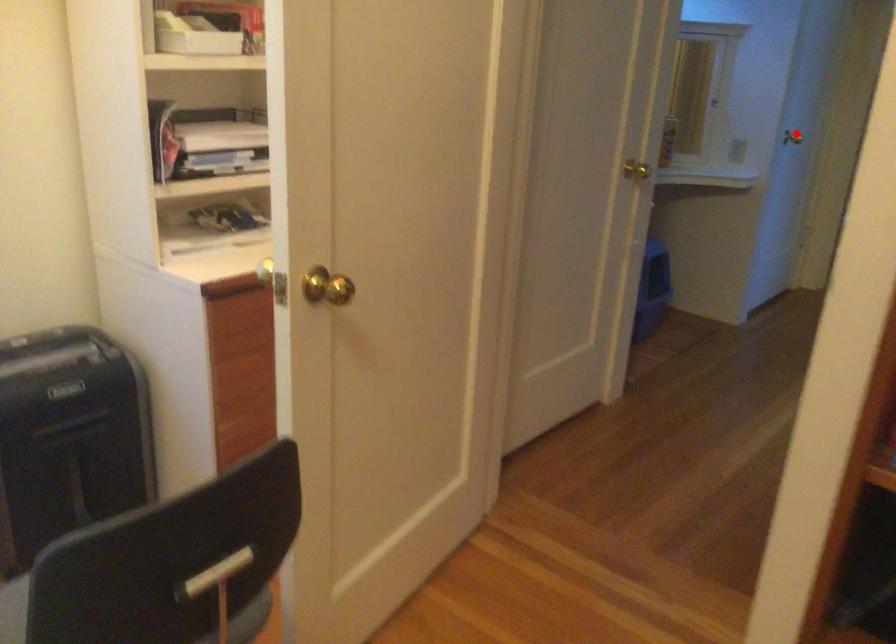
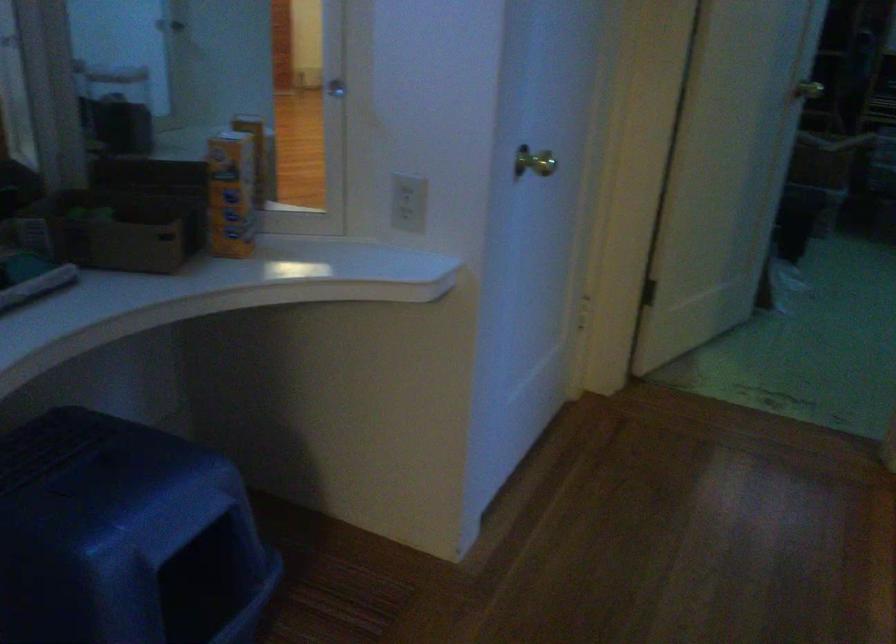
Locate, in the second image, the point that corresponds to the highlighted location in the first image.

(533, 162)